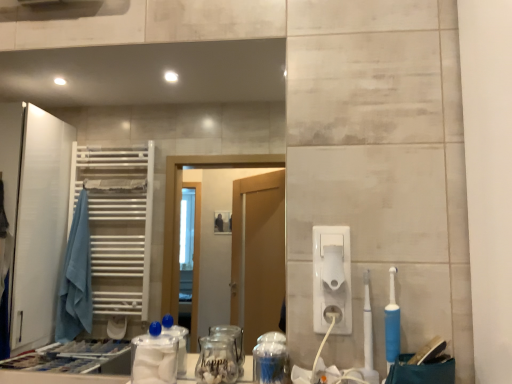
Question: Is white plastic toilet paper at center-right far from transparent glass jar at center, the 2th glass jar when ordered from right to left?

Choices:
 (A) no
 (B) yes

Answer: (A)

Question: Does white plastic toilet paper at center-right touch transparent glass jar at center, the 1th glass jar viewed from the left?

Choices:
 (A) yes
 (B) no

Answer: (B)

Question: Is white plastic toilet paper at center-right positioned beyond the bounds of transparent glass jar at center, the 1th glass jar viewed from the left?

Choices:
 (A) yes
 (B) no

Answer: (A)

Question: From the image's perspective, is white plastic toilet paper at center-right located above transparent glass jar at center, the 1th glass jar viewed from the left?

Choices:
 (A) yes
 (B) no

Answer: (A)

Question: Does white plastic toilet paper at center-right appear on the right side of transparent glass jar at center, the 2th glass jar when ordered from right to left?

Choices:
 (A) yes
 (B) no

Answer: (A)

Question: From a real-world perspective, is white plastic toilet paper at center-right above or below transparent glass jar at center, the 1th glass jar viewed from the left?

Choices:
 (A) above
 (B) below

Answer: (A)

Question: Does point (326, 248) appear closer or farther from the camera than point (220, 345)?

Choices:
 (A) farther
 (B) closer

Answer: (A)

Question: Looking at the image, does white plastic toilet paper at center-right seem bigger or smaller compared to transparent glass jar at center, the 2th glass jar when ordered from right to left?

Choices:
 (A) small
 (B) big

Answer: (A)

Question: Is white plastic toilet paper at center-right in front of or behind transparent glass jar at center, the 2th glass jar when ordered from right to left, in the image?

Choices:
 (A) behind
 (B) front

Answer: (A)

Question: From a real-world perspective, relative to white plastic hand dryer at right, is white plastic toothbrush at right, the first toothbrush from the left, vertically above or below?

Choices:
 (A) above
 (B) below

Answer: (B)

Question: Is white plastic toothbrush at right, placed as the 2th toothbrush when sorted from right to left, to the left or to the right of white plastic hand dryer at right in the image?

Choices:
 (A) right
 (B) left

Answer: (A)

Question: From the image's perspective, is white plastic toothbrush at right, placed as the 2th toothbrush when sorted from right to left, located above or below white plastic hand dryer at right?

Choices:
 (A) above
 (B) below

Answer: (B)

Question: Is white plastic toothbrush at right, placed as the 2th toothbrush when sorted from right to left, inside the boundaries of white plastic hand dryer at right, or outside?

Choices:
 (A) inside
 (B) outside

Answer: (B)

Question: In terms of size, does white plastic hand dryer at right appear bigger or smaller than blue rubber toothbrush at right, which is counted as the 2th toothbrush, starting from the left?

Choices:
 (A) small
 (B) big

Answer: (A)

Question: In terms of width, does white plastic hand dryer at right look wider or thinner when compared to blue rubber toothbrush at right, which is counted as the 2th toothbrush, starting from the left?

Choices:
 (A) thin
 (B) wide

Answer: (A)